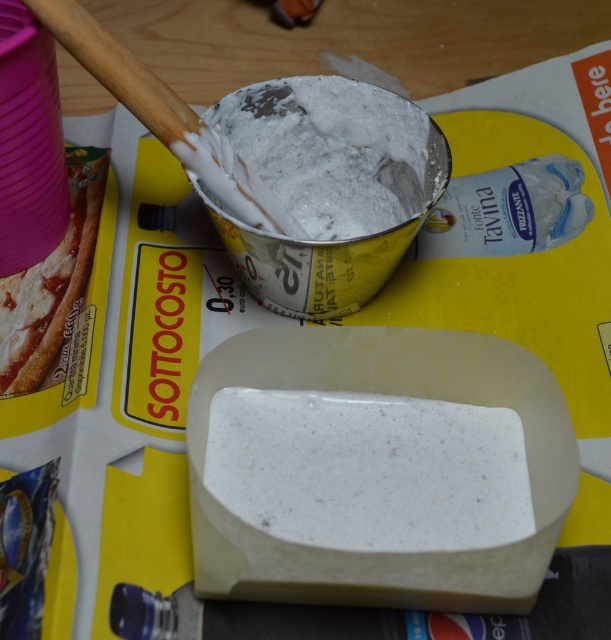
Question: Where is white speckled soap at center located in relation to matte cardboard pizza at upper left in the image?

Choices:
 (A) right
 (B) left

Answer: (A)

Question: Is the position of white speckled soap at center less distant than that of matte cardboard pizza at upper left?

Choices:
 (A) yes
 (B) no

Answer: (A)

Question: Which object is closer to the camera taking this photo?

Choices:
 (A) matte cardboard pizza at upper left
 (B) white speckled soap at center

Answer: (B)

Question: In this image, where is white speckled soap at center located relative to matte cardboard pizza at upper left?

Choices:
 (A) left
 (B) right

Answer: (B)